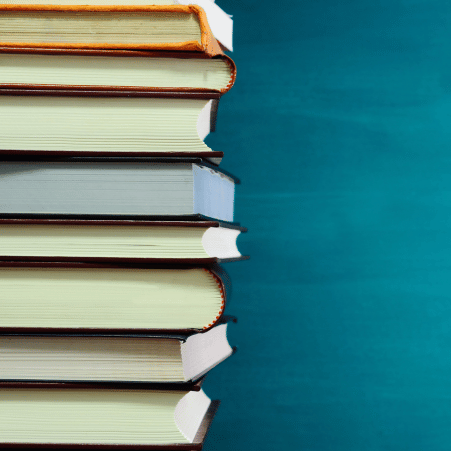
The width and height of the screenshot is (451, 451). In order to click on books in this screenshot , I will do `click(219, 25)`, `click(186, 36)`, `click(186, 74)`, `click(186, 110)`, `click(181, 183)`, `click(180, 234)`, `click(180, 286)`, `click(114, 360)`, `click(116, 403)`.